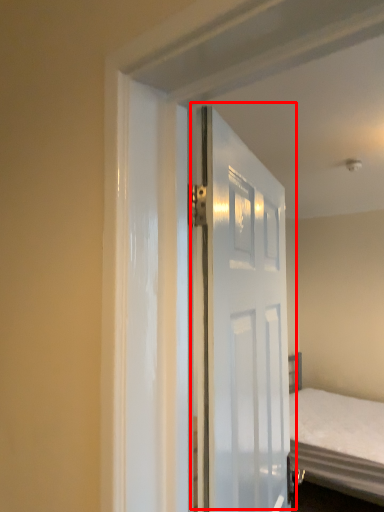
Question: Where is door (annotated by the red box) located in relation to bed in the image?

Choices:
 (A) left
 (B) right

Answer: (A)